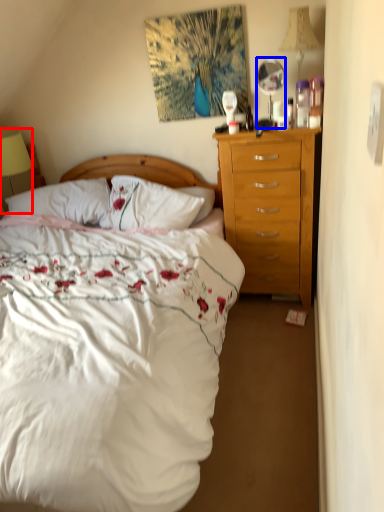
Question: Among these objects, which one is farthest to the camera, lamp (highlighted by a red box) or mirror (highlighted by a blue box)?

Choices:
 (A) lamp
 (B) mirror

Answer: (A)